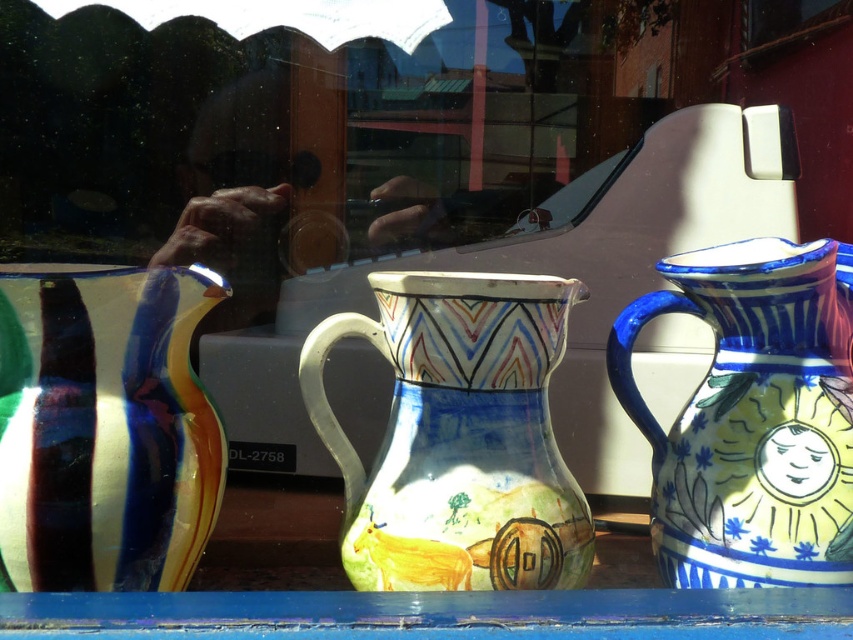
You are a customer in the shop and want to choose a jug that can hold more liquid. Based on their sizes, which jug between the shiny ceramic jug at left and the blue glazed jug at right would you recommend?

The blue glazed jug at right is taller than the shiny ceramic jug at left, so it likely has a larger capacity and can hold more liquid.

You are standing in front of the shop window and want to touch the two points marked in the scene. Which point, point (73,417) or point (701,429), would require you to reach further forward to touch?

Point (701,429) would require reaching further forward because it is farther from the camera compared to point (73,417).